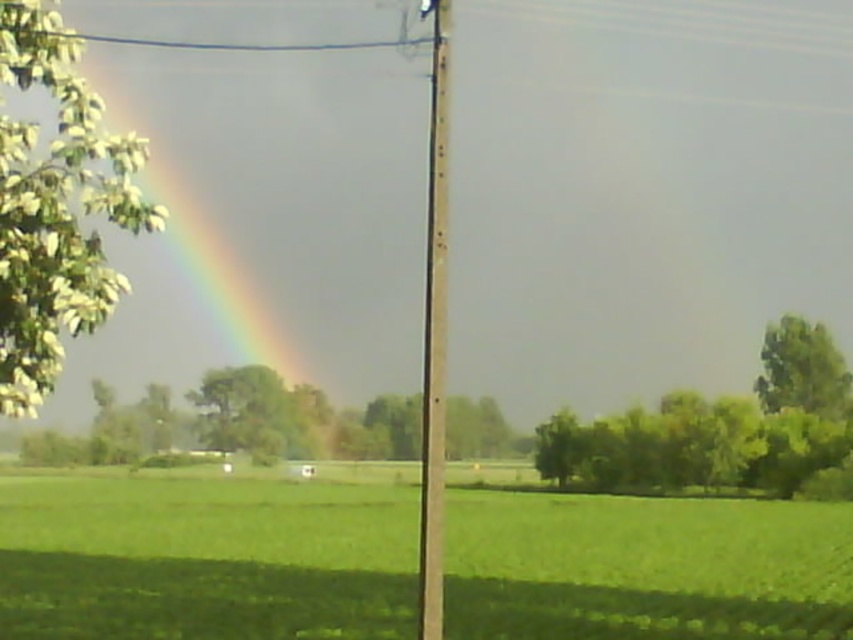
You are a photographer trying to capture the green grassy field at center and the rainbow at upper left in a single shot. Based on their sizes in the image, which object would require you to adjust your camera settings to ensure proper focus and exposure?

The rainbow at upper left is larger than the green grassy field at center, so you should adjust your camera settings to focus on the rainbow at upper left to ensure proper exposure and focus.

You are a bird flying over the rural landscape. You see the green leafy tree at left and the green leafy tree at center. Which tree would block your view of the other tree if you fly directly between them?

The green leafy tree at left is in front of the green leafy tree at center, so if you fly directly between them, the green leafy tree at left would block your view of the green leafy tree at center.